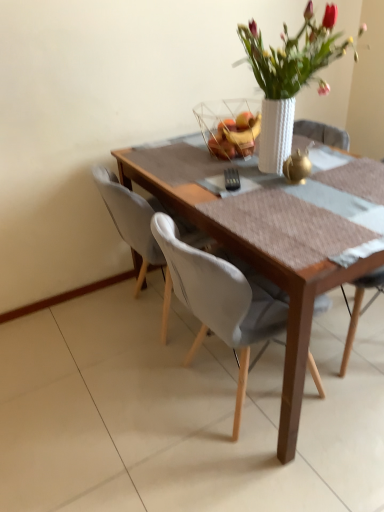
Question: Is white fabric chair at center wider or thinner than wooden table at center?

Choices:
 (A) thin
 (B) wide

Answer: (A)

Question: Based on their sizes in the image, would you say white fabric chair at center is bigger or smaller than wooden table at center?

Choices:
 (A) big
 (B) small

Answer: (B)

Question: Estimate the real-world distances between objects in this image. Which object is closer to the translucent glass bowl at center?

Choices:
 (A) wooden table at center
 (B) white fabric chair at center
 (C) white textured vase at upper center

Answer: (C)

Question: Estimate the real-world distances between objects in this image. Which object is farther from the white textured vase at upper center?

Choices:
 (A) white fabric chair at center
 (B) wooden table at center
 (C) translucent glass bowl at center

Answer: (A)